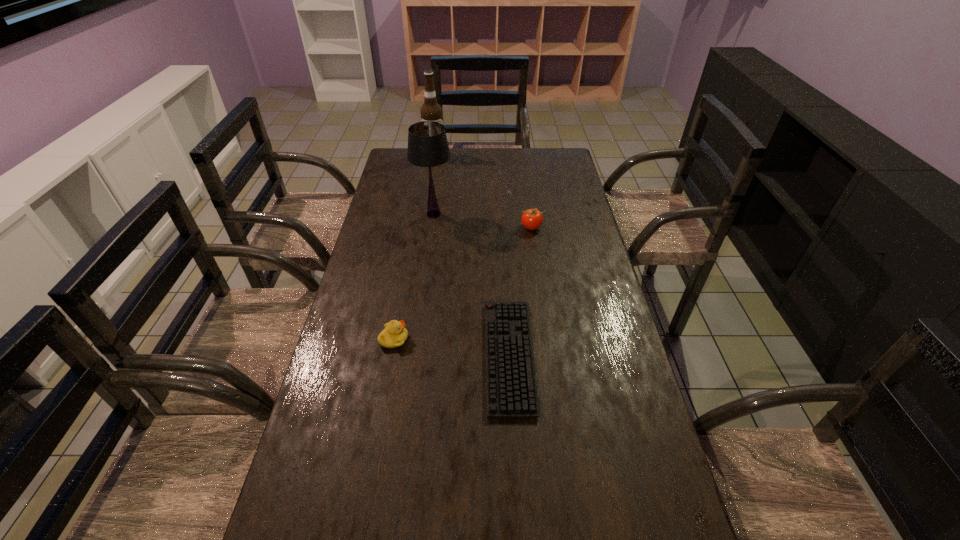
Where is `the farthest object`? This screenshot has height=540, width=960. the farthest object is located at coordinates (430, 111).

Locate an element on the screen. lampshade is located at coordinates (427, 142).

At what (x,y) coordinates should I click in order to perform the action: click on the rightmost object. Please return your answer as a coordinate pair (x, y). The width and height of the screenshot is (960, 540). Looking at the image, I should click on (532, 219).

In order to click on duckling in this screenshot , I will do `click(394, 335)`.

Image resolution: width=960 pixels, height=540 pixels. Find the location of `the shortest object`. the shortest object is located at coordinates (511, 390).

Image resolution: width=960 pixels, height=540 pixels. What are the coordinates of `computer keyboard` in the screenshot? It's located at (511, 390).

This screenshot has height=540, width=960. In order to click on free space located on the label of the alcohol in this screenshot , I will do `click(433, 169)`.

Where is `free space located 0.370m on the front-facing side of the lampshade`? The height and width of the screenshot is (540, 960). free space located 0.370m on the front-facing side of the lampshade is located at coordinates (422, 299).

Locate an element on the screen. The image size is (960, 540). vacant region located 0.090m on the left of the rightmost object is located at coordinates (495, 227).

The height and width of the screenshot is (540, 960). I want to click on vacant region located 0.050m on the front-facing side of the duckling, so click(x=426, y=339).